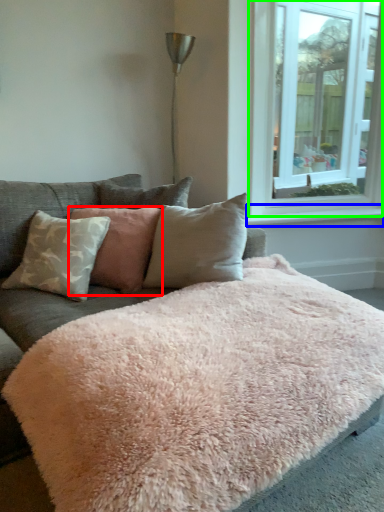
Question: Which is nearer to the pillow (highlighted by a red box)? window sill (highlighted by a blue box) or window (highlighted by a green box).

Choices:
 (A) window sill
 (B) window

Answer: (A)